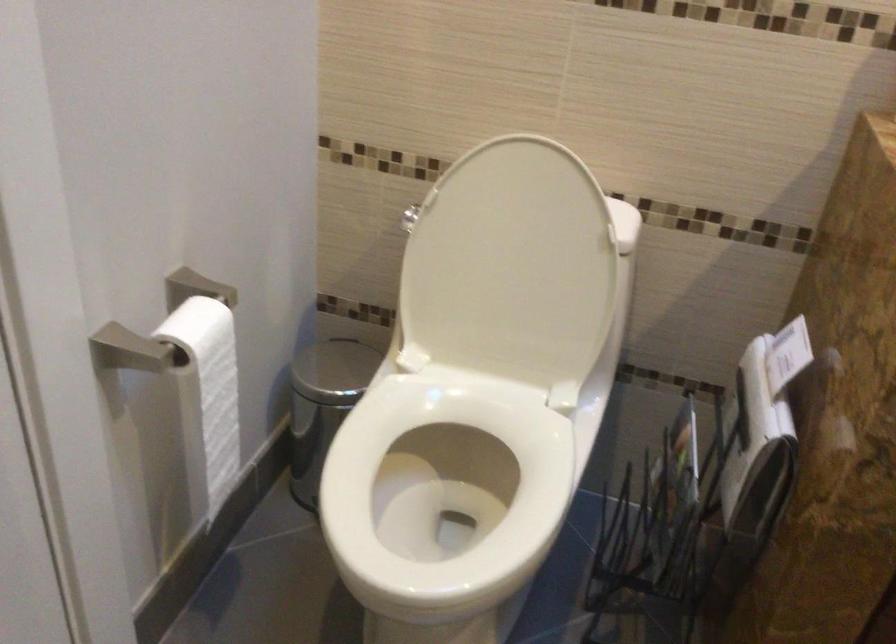
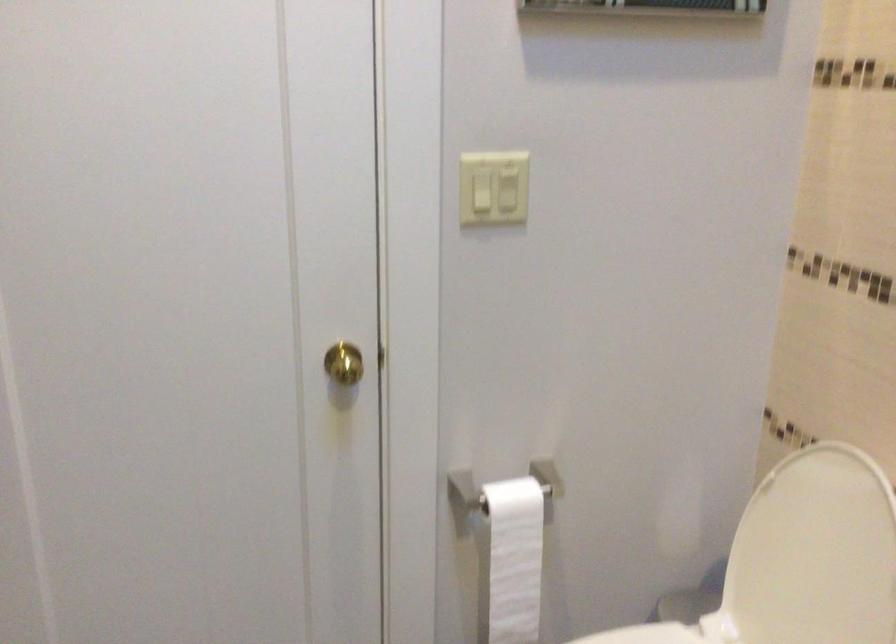
Question: The camera is either moving clockwise (left) or counter-clockwise (right) around the object. The first image is from the beginning of the video and the second image is from the end. Is the camera moving left or right when shooting the video?

Choices:
 (A) Left
 (B) Right

Answer: (B)